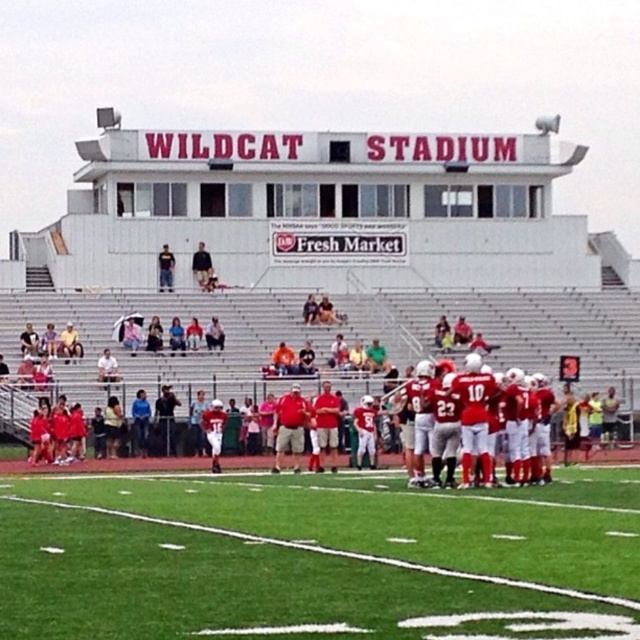
Question: Does green artificial turf at center come in front of red matte jersey at center?

Choices:
 (A) no
 (B) yes

Answer: (B)

Question: Which point is closer to the camera?

Choices:
 (A) red matte jersey at center
 (B) green artificial turf at center

Answer: (B)

Question: From the image, what is the correct spatial relationship of green artificial turf at center in relation to red matte jersey at center?

Choices:
 (A) above
 (B) below

Answer: (B)

Question: Can you confirm if green artificial turf at center is positioned above red matte jersey at center?

Choices:
 (A) no
 (B) yes

Answer: (A)

Question: Which point is farther from the camera taking this photo?

Choices:
 (A) (93, 627)
 (B) (488, 429)

Answer: (B)

Question: Among these points, which one is farthest from the camera?

Choices:
 (A) (148, 592)
 (B) (524, 435)

Answer: (B)